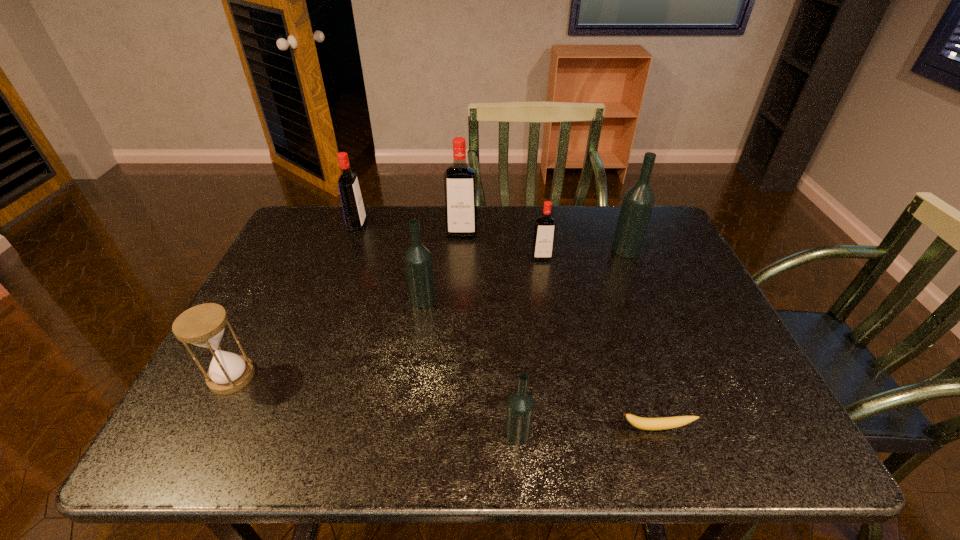
Where is `vacant region located on the front and back of the rightmost red vodka`? vacant region located on the front and back of the rightmost red vodka is located at coordinates point(559,359).

Locate an element on the screen. blank space located on the back of the nearest vodka is located at coordinates (508, 287).

Where is `vacant space located on the right of the white hourglass`? This screenshot has height=540, width=960. vacant space located on the right of the white hourglass is located at coordinates (346, 376).

The height and width of the screenshot is (540, 960). What are the coordinates of `vodka that is at the near edge` in the screenshot? It's located at (520, 405).

Find the location of a particular element. banana located in the near edge section of the desktop is located at coordinates (649, 424).

Locate an element on the screen. object that is at the left edge is located at coordinates (203, 325).

This screenshot has width=960, height=540. In order to click on object that is at the right edge in this screenshot , I will do `click(638, 201)`.

The height and width of the screenshot is (540, 960). I want to click on object that is at the far right corner, so click(x=638, y=201).

Where is `vacant space at the far edge`? Image resolution: width=960 pixels, height=540 pixels. vacant space at the far edge is located at coordinates (429, 214).

Identify the location of free region at the near edge. The image size is (960, 540). (608, 435).